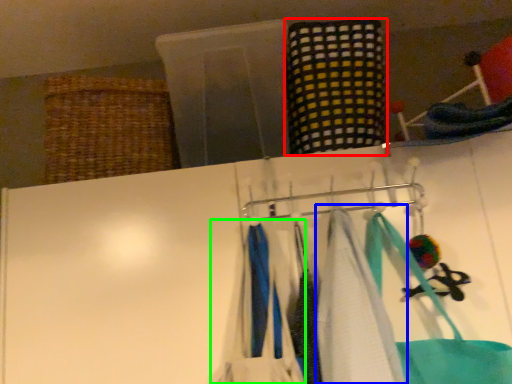
Question: Estimate the real-world distances between objects in this image. Which object is closer to clothing (highlighted by a red box), towel (highlighted by a blue box) or clothing (highlighted by a green box)?

Choices:
 (A) towel
 (B) clothing

Answer: (A)